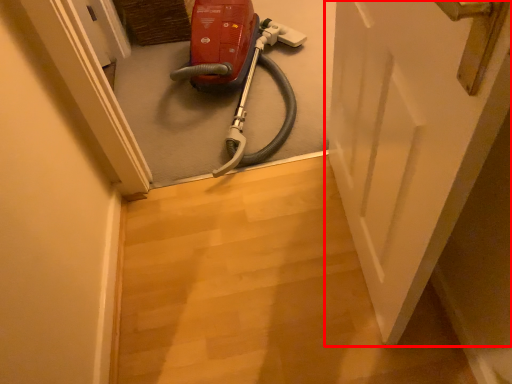
Question: From the image's perspective, where is door (annotated by the red box) located in relation to equipment in the image?

Choices:
 (A) below
 (B) above

Answer: (A)